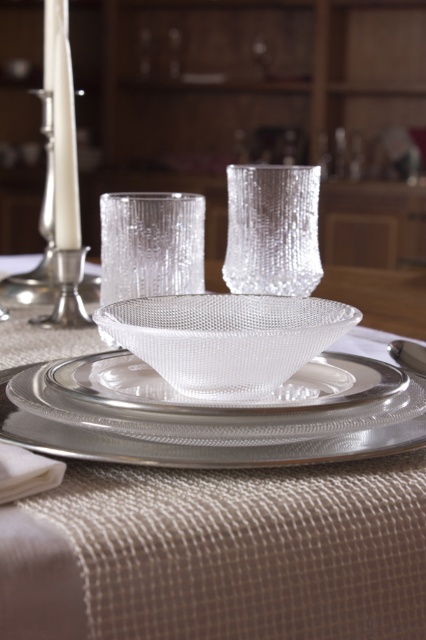
Is satin glass bowl at center thinner than satin silver saucer at center?

No, satin glass bowl at center is not thinner than satin silver saucer at center.

Is satin glass bowl at center positioned at the back of satin silver saucer at center?

No, satin glass bowl at center is closer to the viewer.

Does point (319, 467) come closer to viewer compared to point (112, 381)?

That is True.

I want to click on satin glass bowl at center, so click(x=218, y=554).

Does satin silver platter at center have a smaller size compared to satin silver saucer at center?

Incorrect, satin silver platter at center is not smaller in size than satin silver saucer at center.

Does point (389, 424) come in front of point (342, 365)?

That is True.

Identify the location of satin silver platter at center. The width and height of the screenshot is (426, 640). (210, 422).

Who is positioned more to the left, satin glass bowl at center or satin silver platter at center?

From the viewer's perspective, satin silver platter at center appears more on the left side.

Between satin glass bowl at center and satin silver platter at center, which one has less height?

satin silver platter at center is shorter.

Describe the element at coordinates (218, 554) in the screenshot. I see `satin glass bowl at center` at that location.

At what (x,y) coordinates should I click in order to perform the action: click on satin glass bowl at center. Please return your answer as a coordinate pair (x, y). Looking at the image, I should click on (218, 554).